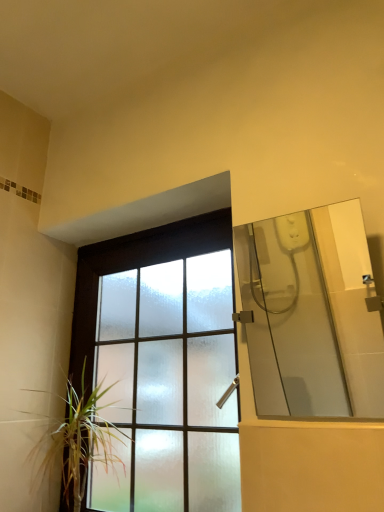
Question: Is the position of transparent glass shower door at right less distant than that of frosted glass window at center?

Choices:
 (A) yes
 (B) no

Answer: (A)

Question: From a real-world perspective, is transparent glass shower door at right physically below frosted glass window at center?

Choices:
 (A) yes
 (B) no

Answer: (B)

Question: From the image's perspective, is transparent glass shower door at right beneath frosted glass window at center?

Choices:
 (A) yes
 (B) no

Answer: (B)

Question: Is transparent glass shower door at right far away from frosted glass window at center?

Choices:
 (A) no
 (B) yes

Answer: (B)

Question: Is transparent glass shower door at right wider than frosted glass window at center?

Choices:
 (A) no
 (B) yes

Answer: (A)

Question: Is transparent glass shower door at right facing towards frosted glass window at center?

Choices:
 (A) yes
 (B) no

Answer: (B)

Question: Is green leafy plant at lower left turned away from frosted glass window at center?

Choices:
 (A) no
 (B) yes

Answer: (B)

Question: Is green leafy plant at lower left at the left side of frosted glass window at center?

Choices:
 (A) no
 (B) yes

Answer: (B)

Question: Is green leafy plant at lower left not within frosted glass window at center?

Choices:
 (A) yes
 (B) no

Answer: (B)

Question: Is green leafy plant at lower left shorter than frosted glass window at center?

Choices:
 (A) yes
 (B) no

Answer: (A)

Question: Would you say green leafy plant at lower left is a long distance from frosted glass window at center?

Choices:
 (A) yes
 (B) no

Answer: (B)

Question: From the image's perspective, is green leafy plant at lower left over frosted glass window at center?

Choices:
 (A) yes
 (B) no

Answer: (B)

Question: Is frosted glass window at center positioned far away from green leafy plant at lower left?

Choices:
 (A) no
 (B) yes

Answer: (A)